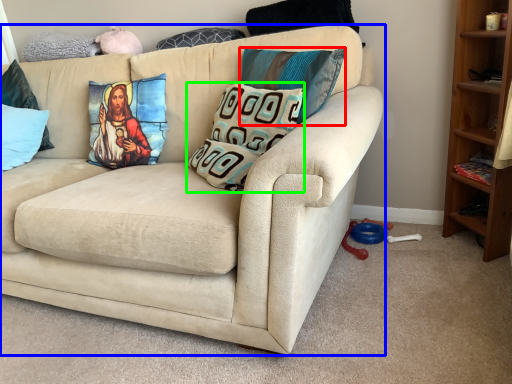
Question: Which object is positioned closest to pillow (highlighted by a red box)? Select from studio couch (highlighted by a blue box) and pillow (highlighted by a green box).

Choices:
 (A) studio couch
 (B) pillow

Answer: (B)